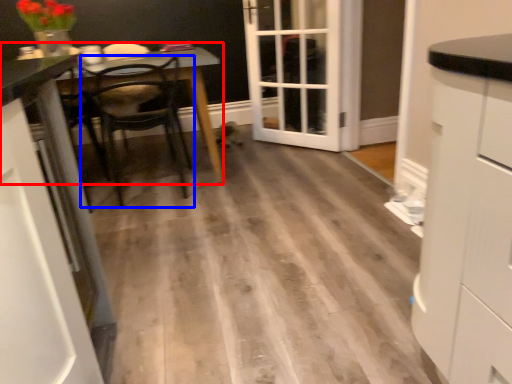
Question: Among these objects, which one is farthest to the camera, table (highlighted by a red box) or chair (highlighted by a blue box)?

Choices:
 (A) table
 (B) chair

Answer: (A)